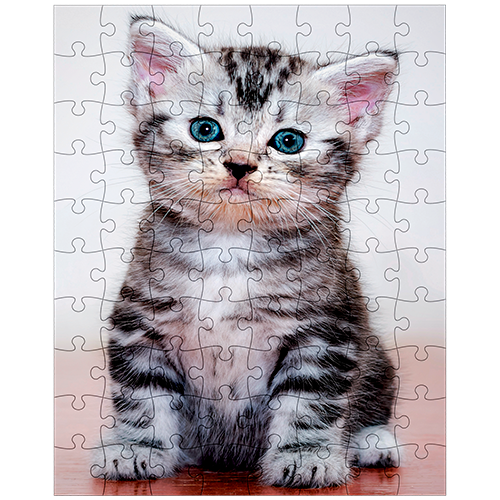
The width and height of the screenshot is (500, 500). I want to click on corner pieces, so click(426, 490), click(64, 477), click(88, 30), click(430, 17).